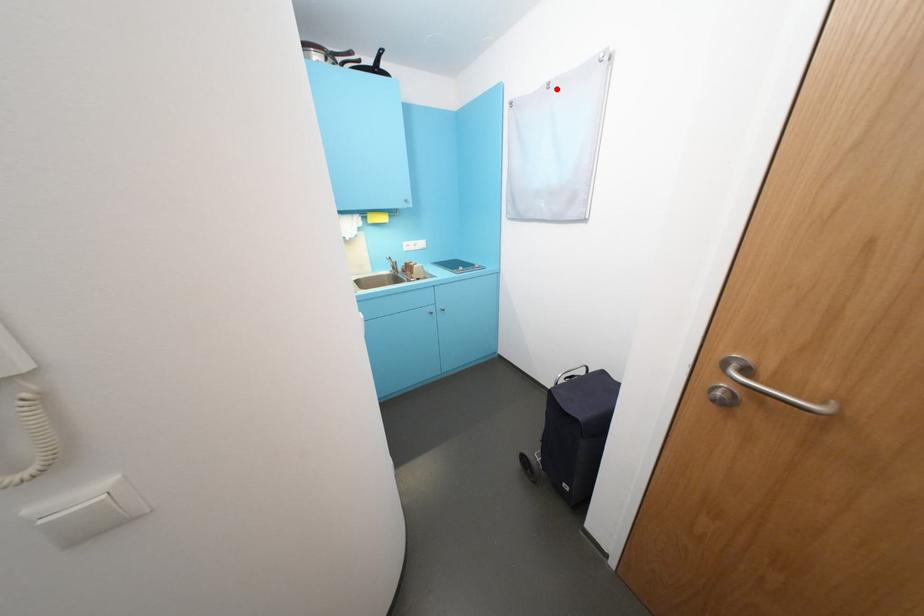
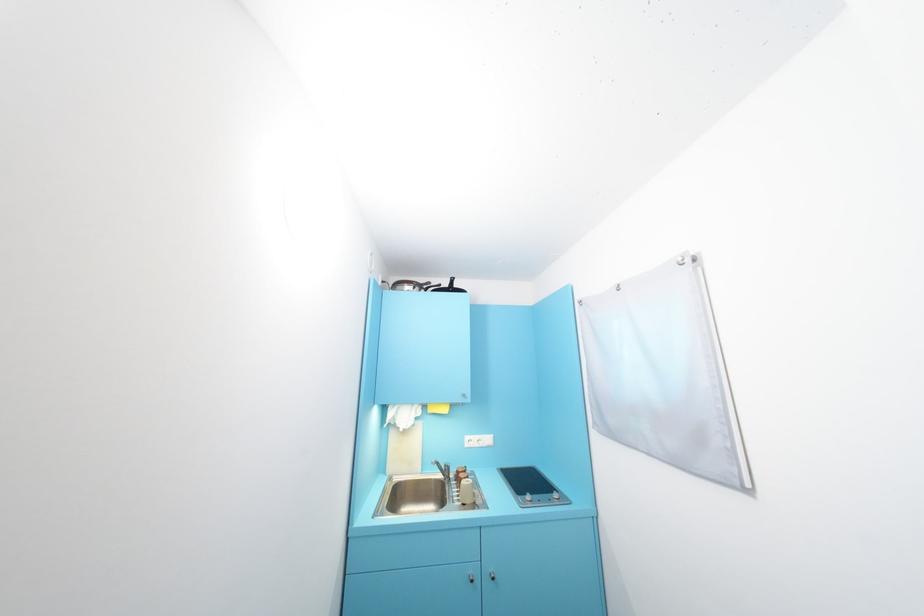
Where in the second image is the point corresponding to the highlighted location from the first image?

(626, 291)